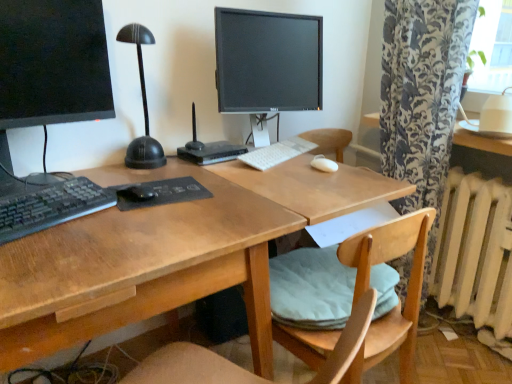
Question: Is white plastic keyboard at center closer to the viewer compared to white matte mouse at center?

Choices:
 (A) yes
 (B) no

Answer: (B)

Question: From a real-world perspective, is white plastic keyboard at center beneath white matte mouse at center?

Choices:
 (A) yes
 (B) no

Answer: (A)

Question: Considering the relative sizes of white plastic keyboard at center and white matte mouse at center in the image provided, is white plastic keyboard at center shorter than white matte mouse at center?

Choices:
 (A) no
 (B) yes

Answer: (A)

Question: Is the depth of white plastic keyboard at center greater than that of white matte mouse at center?

Choices:
 (A) yes
 (B) no

Answer: (A)

Question: Can you confirm if white plastic keyboard at center is bigger than white matte mouse at center?

Choices:
 (A) yes
 (B) no

Answer: (A)

Question: Does white plastic keyboard at center have a greater width compared to white matte mouse at center?

Choices:
 (A) yes
 (B) no

Answer: (A)

Question: Is matte black monitor at center, acting as the second computer monitor starting from the front, to the right of light wood chair at center from the viewer's perspective?

Choices:
 (A) yes
 (B) no

Answer: (B)

Question: From a real-world perspective, is matte black monitor at center, the first computer monitor from the back, on light wood chair at center?

Choices:
 (A) yes
 (B) no

Answer: (A)

Question: Does matte black monitor at center, the first computer monitor from the back, appear on the left side of light wood chair at center?

Choices:
 (A) no
 (B) yes

Answer: (B)

Question: Is matte black monitor at center, the first computer monitor from the back, shorter than light wood chair at center?

Choices:
 (A) yes
 (B) no

Answer: (A)

Question: Considering the relative sizes of matte black monitor at center, which appears as the 1th computer monitor when viewed from the right, and light wood chair at center in the image provided, is matte black monitor at center, which appears as the 1th computer monitor when viewed from the right, thinner than light wood chair at center?

Choices:
 (A) yes
 (B) no

Answer: (A)

Question: Is the position of matte black monitor at center, acting as the second computer monitor starting from the front, more distant than that of light wood chair at center?

Choices:
 (A) yes
 (B) no

Answer: (A)

Question: From a real-world perspective, is matte black monitor at center, acting as the second computer monitor starting from the front, below white matte mouse at center?

Choices:
 (A) no
 (B) yes

Answer: (A)